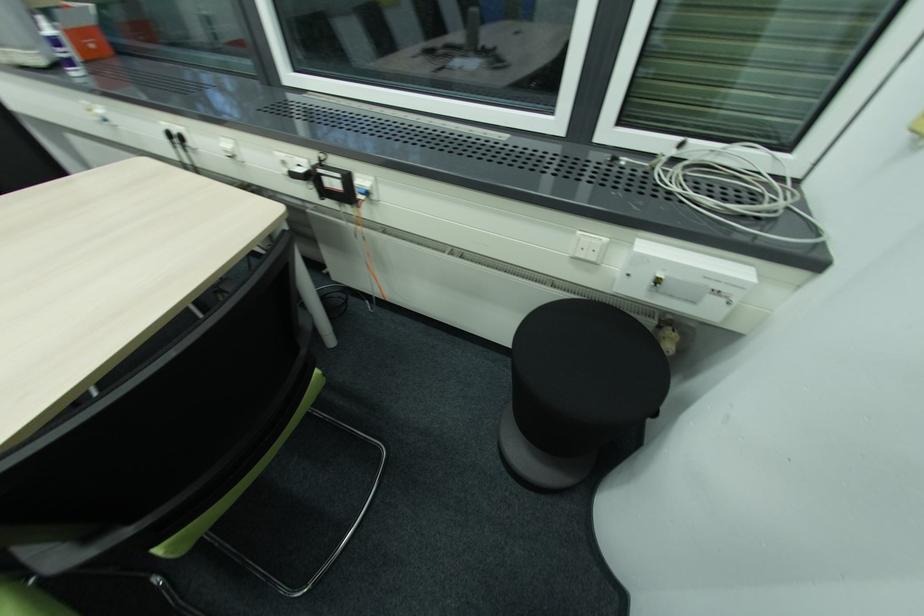
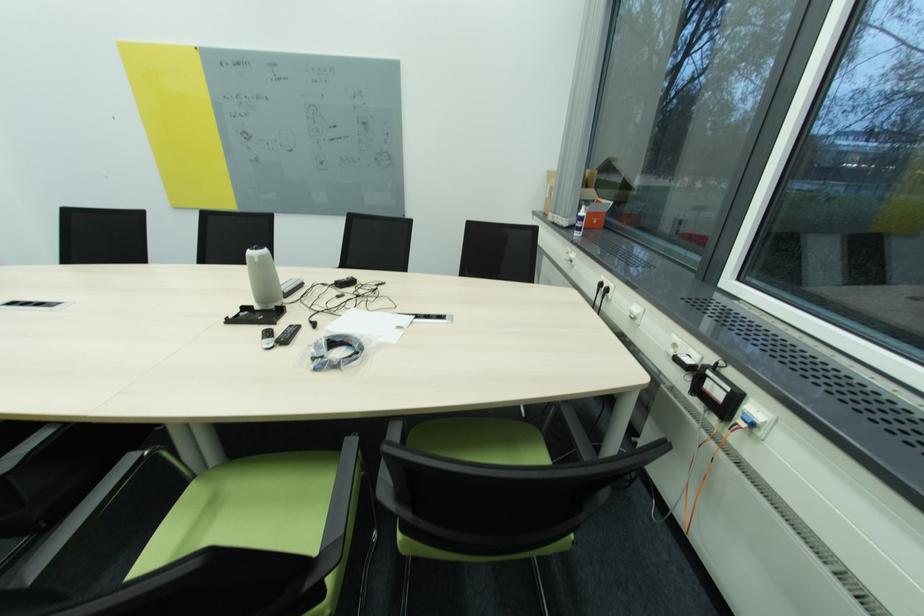
Locate, in the second image, the point that corresponds to the point at 324,172 in the first image.

(713, 373)